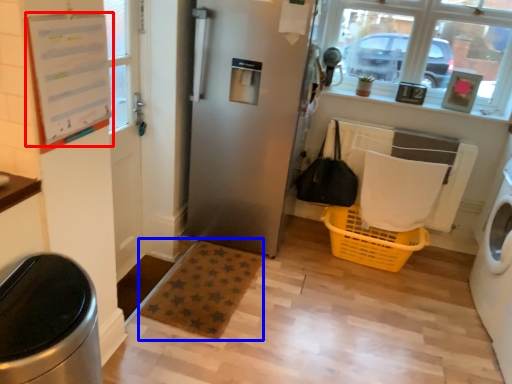
Question: Among these objects, which one is farthest to the camera, bulletin board (highlighted by a red box) or plain (highlighted by a blue box)?

Choices:
 (A) bulletin board
 (B) plain

Answer: (B)